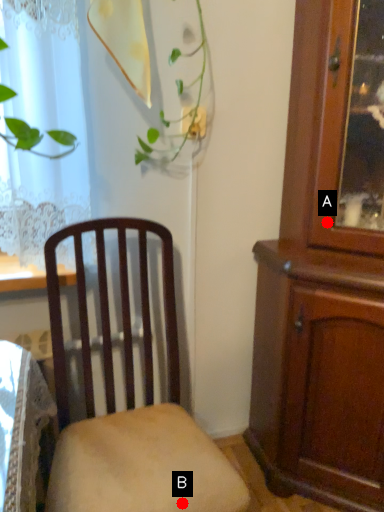
Question: Two points are circled on the image, labeled by A and B beside each circle. Which point is farther from the camera taking this photo?

Choices:
 (A) A is further
 (B) B is further

Answer: (A)